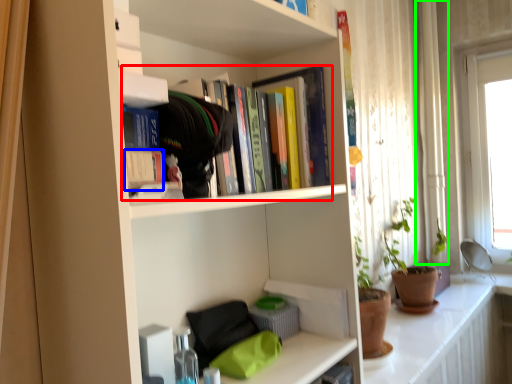
Question: Which is nearer to the book (highlighted by a red box)? paperback book (highlighted by a blue box) or curtain (highlighted by a green box).

Choices:
 (A) paperback book
 (B) curtain

Answer: (A)